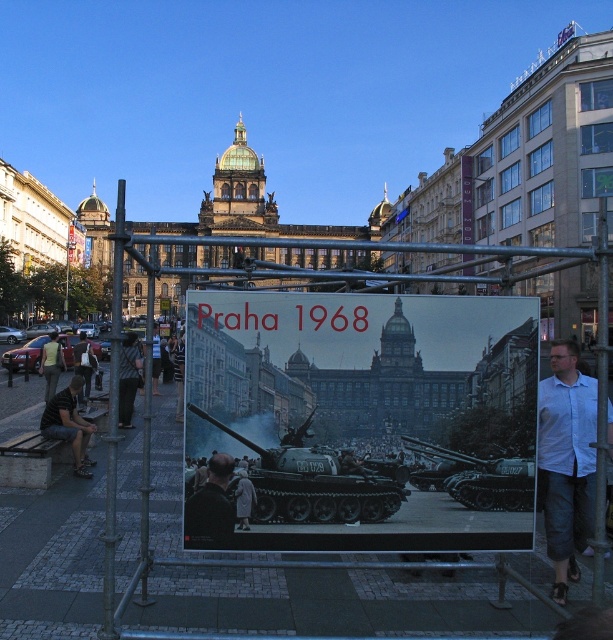
Question: Which object is the farthest from the dark gray pants at left?

Choices:
 (A) dark gray metallic tank at center
 (B) white shirt at center right
 (C) metallic tank at center

Answer: (B)

Question: Which is nearer to the white shirt at center right?

Choices:
 (A) green matte tank at center
 (B) dark gray metallic tank at center
 (C) dark gray jeans at left

Answer: (B)

Question: In this image, where is dark gray metallic tank at center located relative to dark blue shirt at center?

Choices:
 (A) left
 (B) right

Answer: (B)

Question: Can you confirm if metallic tank at center is wider than white shirt at center right?

Choices:
 (A) no
 (B) yes

Answer: (B)

Question: Considering the real-world distances, which object is farthest from the dark gray pants at left?

Choices:
 (A) dark blue shirt at center
 (B) dark gray jeans at left
 (C) dark blue jeans at left
 (D) green matte tank at center

Answer: (D)

Question: Can you confirm if metallic tank at center is bigger than dark blue shirt at center?

Choices:
 (A) yes
 (B) no

Answer: (A)